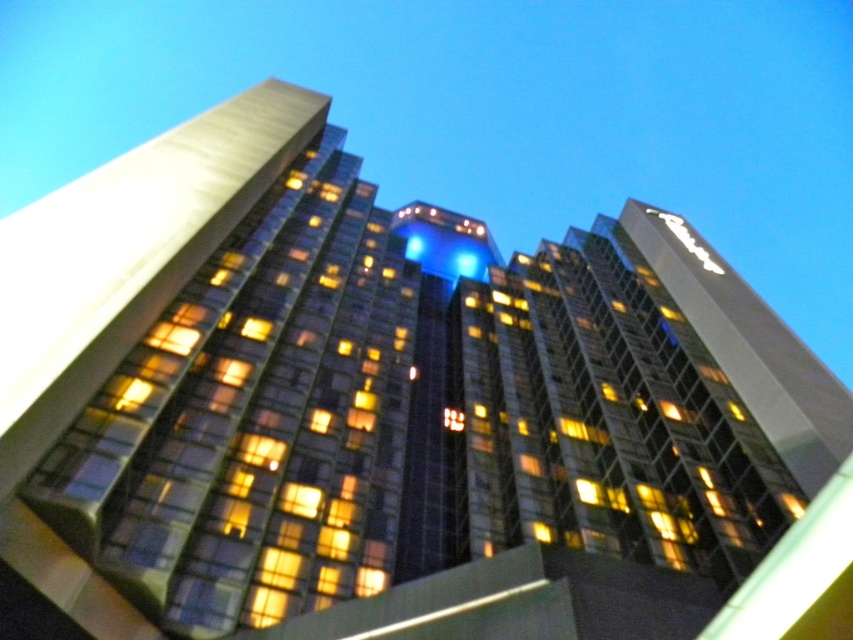
Is the position of glassy reflective building at center more distant than that of white glossy sign at upper right?

No, it is not.

Between glassy reflective building at center and white glossy sign at upper right, which one has more height?

glassy reflective building at center is taller.

Which is behind, point (279, 481) or point (721, 266)?

Point (721, 266)

The width and height of the screenshot is (853, 640). In order to click on glassy reflective building at center in this screenshot , I will do `click(206, 378)`.